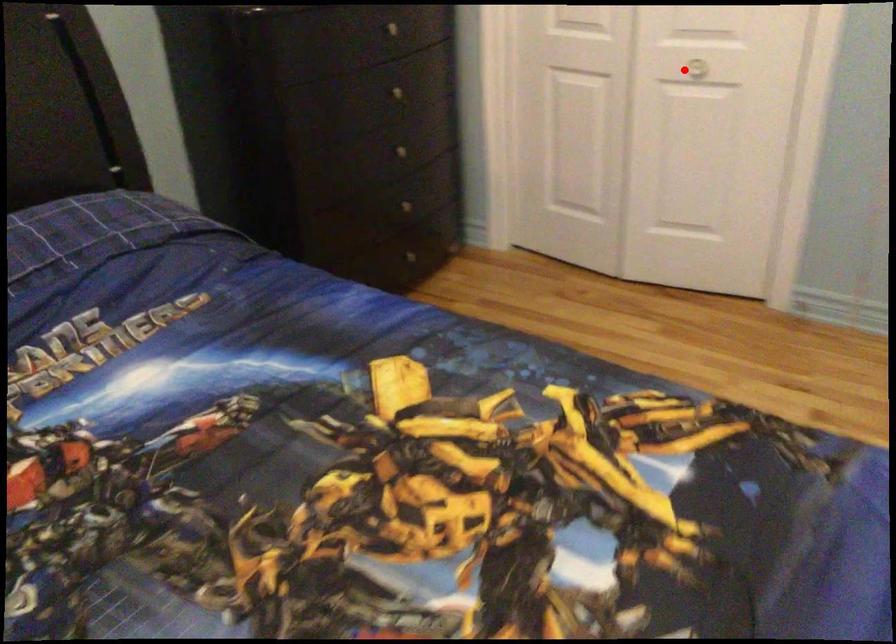
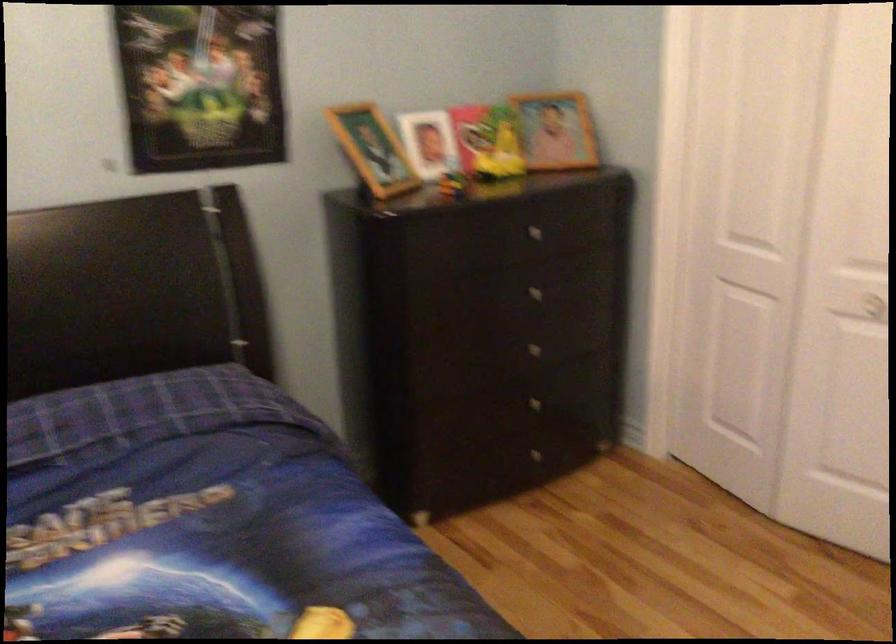
Where in the second image is the point corresponding to the highlighted location from the first image?

(864, 305)